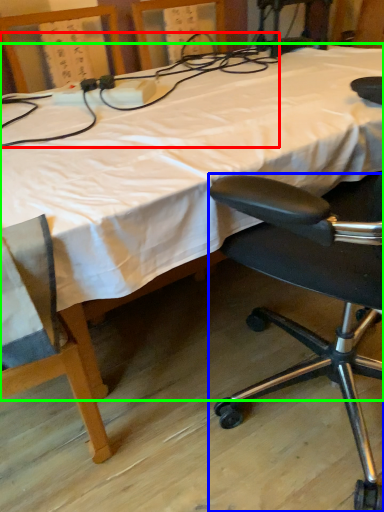
Question: Which object is the farthest from twin (highlighted by a red box)? Choose among these: chair (highlighted by a blue box) or bed (highlighted by a green box).

Choices:
 (A) chair
 (B) bed

Answer: (A)